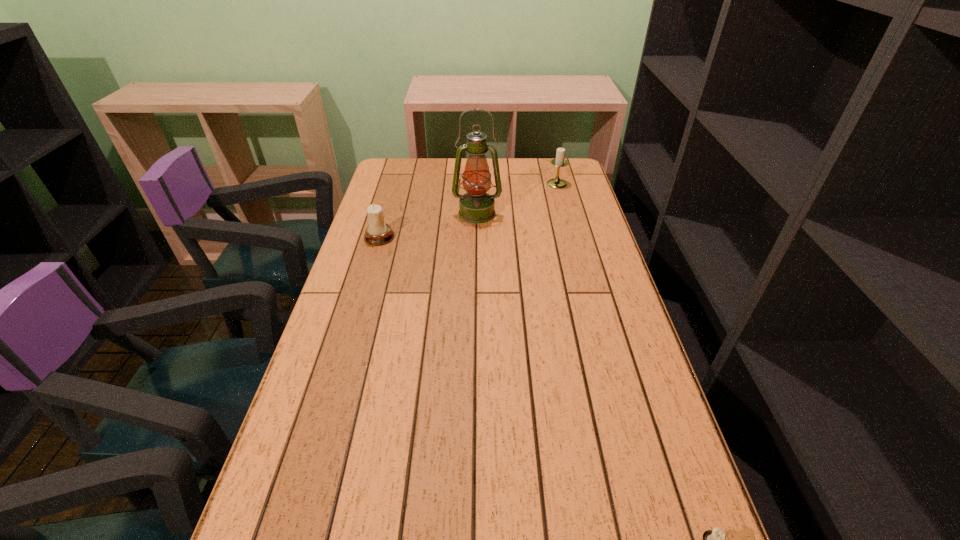
Where is `object that is positioned at the left edge`? The image size is (960, 540). object that is positioned at the left edge is located at coordinates (378, 232).

Locate an element on the screen. Image resolution: width=960 pixels, height=540 pixels. object located at the right edge is located at coordinates (559, 161).

Where is `object situated at the far right corner`? object situated at the far right corner is located at coordinates pyautogui.click(x=559, y=161).

In order to click on vacant space at the far edge of the desktop in this screenshot , I will do [447, 159].

Image resolution: width=960 pixels, height=540 pixels. Find the location of `vacant space at the left edge`. vacant space at the left edge is located at coordinates (396, 222).

Locate an element on the screen. vacant region at the right edge of the desktop is located at coordinates (616, 362).

This screenshot has width=960, height=540. In order to click on vacant area at the far left corner of the desktop in this screenshot , I will do `click(416, 174)`.

Image resolution: width=960 pixels, height=540 pixels. What are the coordinates of `unoccupied position between the third object from right to left and the second nearest candle holder` in the screenshot? It's located at (428, 225).

This screenshot has height=540, width=960. I want to click on object that is the second closest to the leftmost candle holder, so click(x=559, y=161).

Identify which object is located as the second nearest to the third object from right to left. Please provide its 2D coordinates. Your answer should be formatted as a tuple, i.e. [(x, y)], where the tuple contains the x and y coordinates of a point satisfying the conditions above.

[(559, 161)]